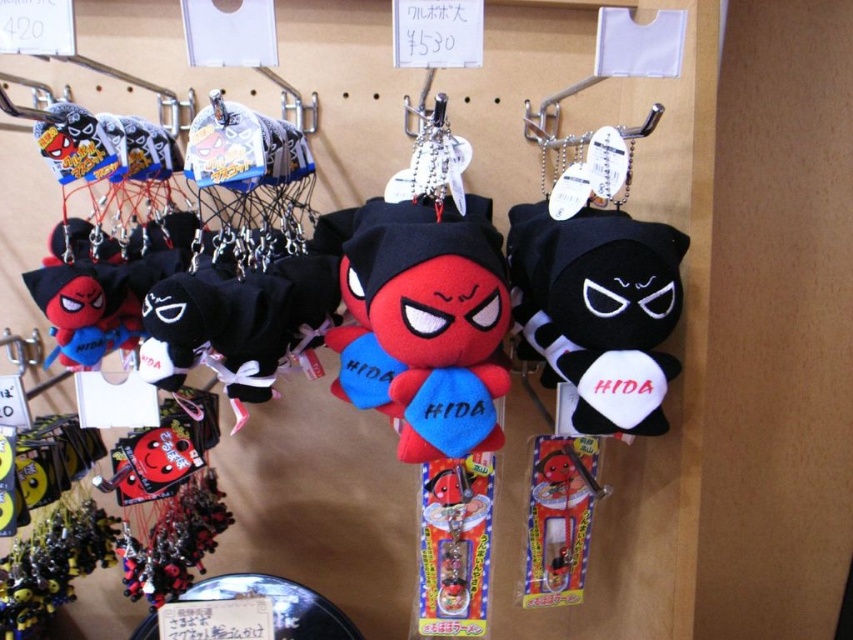
Measure the distance from matte plush toy at center to black plush toy at center-right.

5.83 inches

Does matte plush toy at center have a greater width compared to black plush toy at center-right?

Yes.

Who is more forward, (364, 216) or (584, 256)?

Point (584, 256) is more forward.

The image size is (853, 640). I want to click on matte plush toy at center, so click(x=422, y=323).